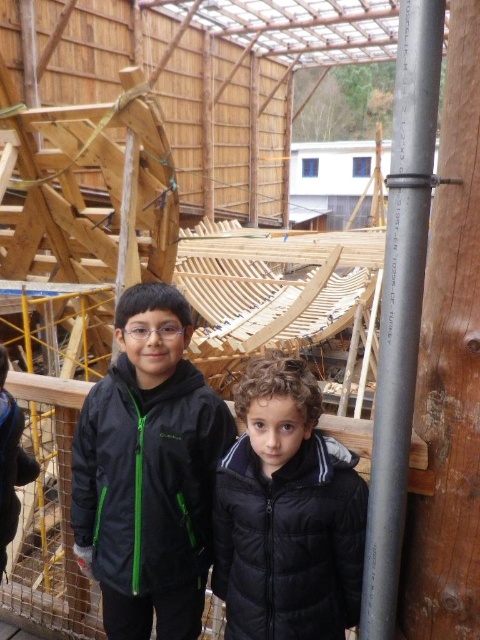
Does black puffy jacket at center come in front of gray metallic pole at right?

No.

Who is lower down, black puffy jacket at center or gray metallic pole at right?

Positioned lower is black puffy jacket at center.

You are a GUI agent. You are given a task and a screenshot of the screen. Output one action in this format:
    pyautogui.click(x=<x>, y=<y>)
    Task: Click on the black puffy jacket at center
    
    Given the screenshot: What is the action you would take?
    pyautogui.click(x=289, y=541)

Is gray metallic pole at right smaller than black matte jacket at lower left?

Actually, gray metallic pole at right might be larger than black matte jacket at lower left.

Consider the image. Does gray metallic pole at right appear under black matte jacket at lower left?

No, gray metallic pole at right is not below black matte jacket at lower left.

The width and height of the screenshot is (480, 640). I want to click on gray metallic pole at right, so click(400, 305).

Which is in front, point (182, 509) or point (17, 513)?

Point (182, 509) is in front.

What do you see at coordinates (147, 477) in the screenshot? I see `black matte jacket at center` at bounding box center [147, 477].

Describe the element at coordinates (147, 477) in the screenshot. I see `black matte jacket at center` at that location.

Find the location of a particular element. black matte jacket at center is located at coordinates (147, 477).